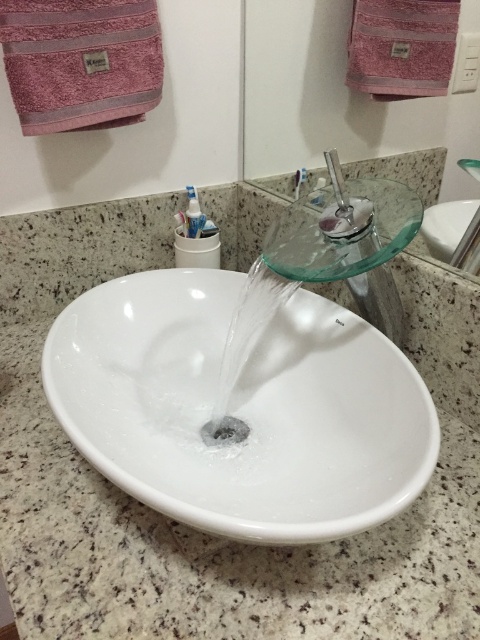
You are standing in front of the bathroom sink and want to reach two points marked on the mirror. The first point is at coordinate point[240,432] and the second is at point[194,227]. Which point should you aim for first if you want to touch the one closer to you?

The point at coordinate point[240,432] is closer to you, so you should aim for that one first.

You are a guest in this bathroom and need to locate both the black metallic drain at center and the white glossy toothpaste at upper center. Based on their positions, which object is closer to the right edge of the sink?

The black metallic drain at center is positioned on the right side of white glossy toothpaste at upper center, so the black metallic drain at center is closer to the right edge of the sink.

You are standing in front of the bathroom sink setup. There is a point at coordinate [240,408]. Which object is located at this coordinate?

The white glossy sink at center is located at the coordinate point [240,408].